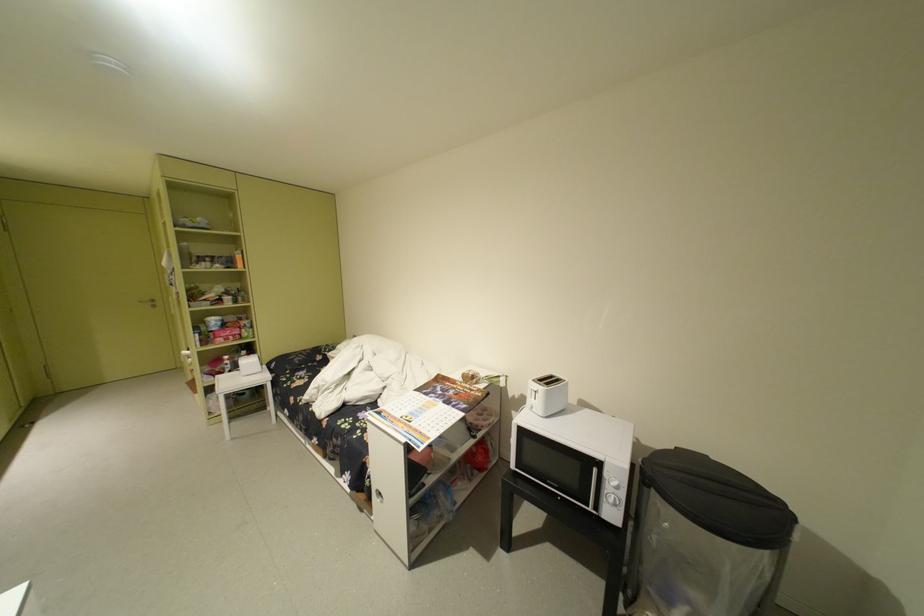
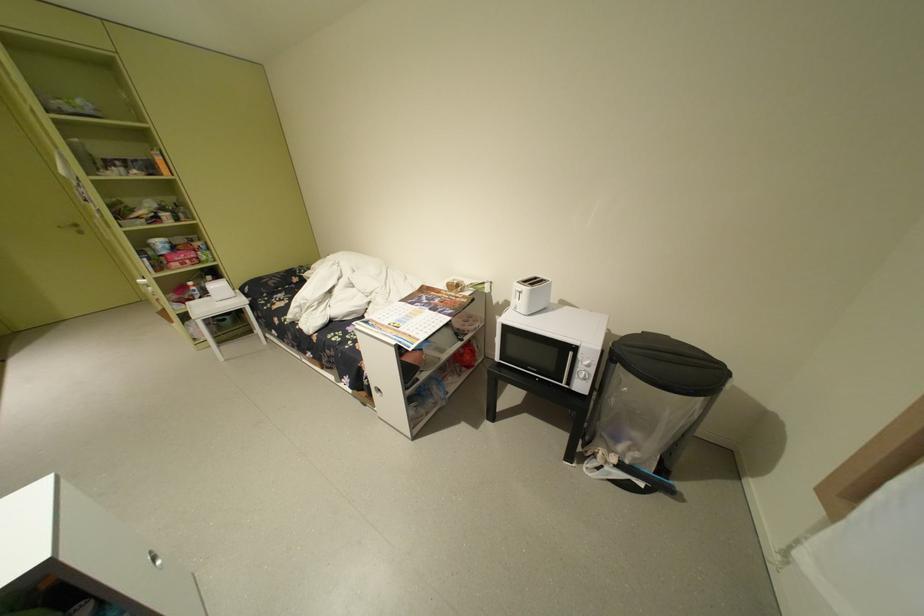
In the second image, find the point that corresponds to (238,360) in the first image.

(204, 286)